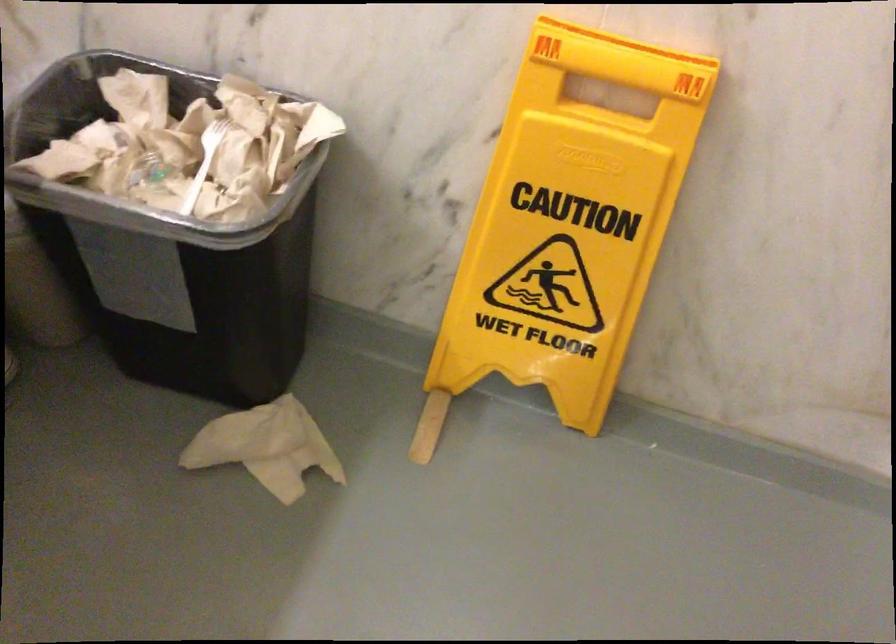
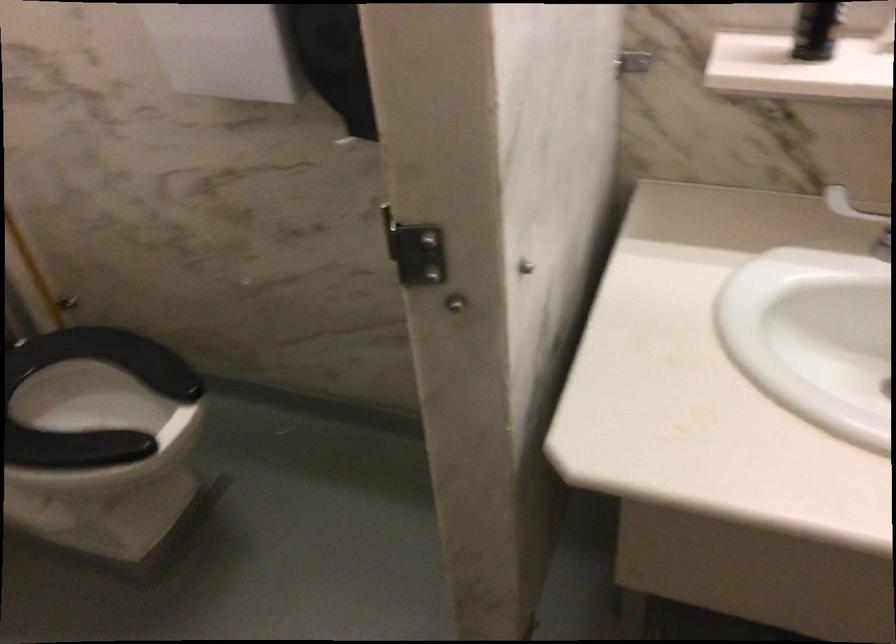
How did the camera likely rotate?

The camera rotated toward left-down.